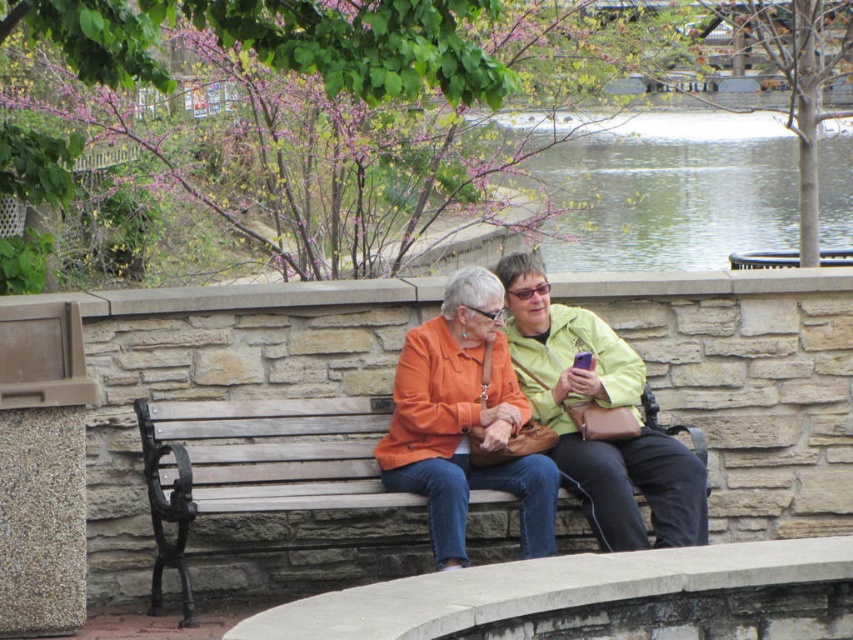
Which is more to the right, wooden bench at center or matte orange jacket at center?

Positioned to the right is matte orange jacket at center.

Is point (265, 486) behind point (659, 500)?

Yes, it is.

Image resolution: width=853 pixels, height=640 pixels. In order to click on wooden bench at center in this screenshot , I will do `click(257, 468)`.